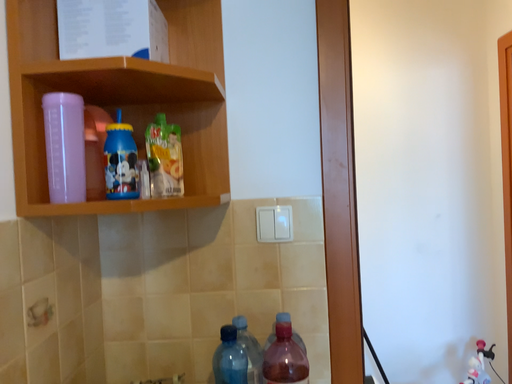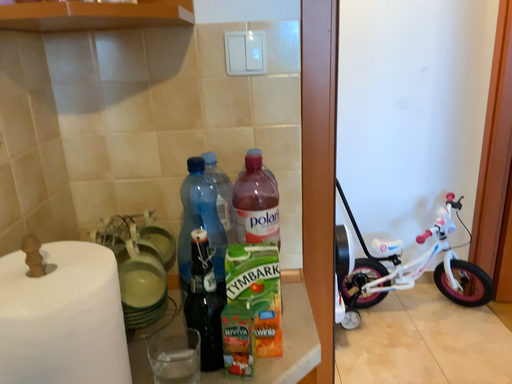
Question: How did the camera likely rotate when shooting the video?

Choices:
 (A) rotated downward
 (B) rotated upward

Answer: (A)